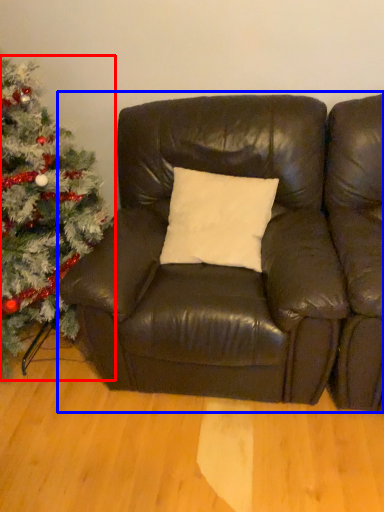
Question: Which object is closer to the camera taking this photo, christmas tree (highlighted by a red box) or studio couch (highlighted by a blue box)?

Choices:
 (A) christmas tree
 (B) studio couch

Answer: (A)